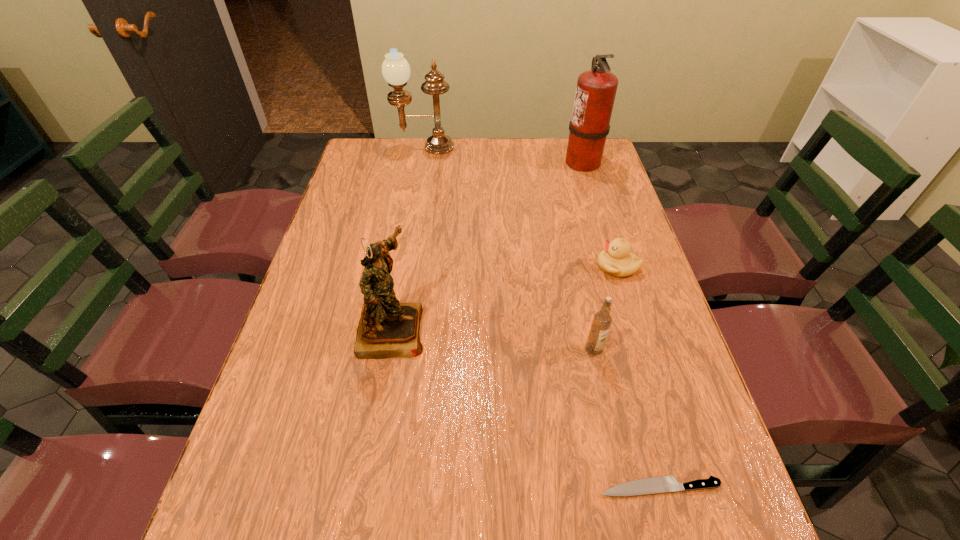
Where is `free space between the third tallest object and the oil lamp`? This screenshot has height=540, width=960. free space between the third tallest object and the oil lamp is located at coordinates (408, 238).

Where is `free spot between the oil lamp and the third shortest object`? The width and height of the screenshot is (960, 540). free spot between the oil lamp and the third shortest object is located at coordinates point(509,248).

Find the location of a particular element. empty space between the duckling and the nearest object is located at coordinates (638, 376).

Identify the location of vacant point located between the steak knife and the oil lamp. The image size is (960, 540). (541, 317).

This screenshot has width=960, height=540. Identify the location of vacant space in between the vodka and the fire extinguisher. (588, 255).

This screenshot has height=540, width=960. I want to click on vacant point located between the figurine and the fire extinguisher, so click(487, 245).

Identify the location of free spot between the third tallest object and the steak knife. This screenshot has height=540, width=960. (525, 407).

Find the location of a particular element. Image resolution: width=960 pixels, height=540 pixels. vacant area between the oil lamp and the second shortest object is located at coordinates (520, 206).

Identify the location of vacant region between the vodka and the oil lamp. The width and height of the screenshot is (960, 540). (509, 248).

At what (x,y) coordinates should I click in order to perform the action: click on free space that is in between the third tallest object and the oil lamp. Please return your answer as a coordinate pair (x, y). The width and height of the screenshot is (960, 540). Looking at the image, I should click on (408, 238).